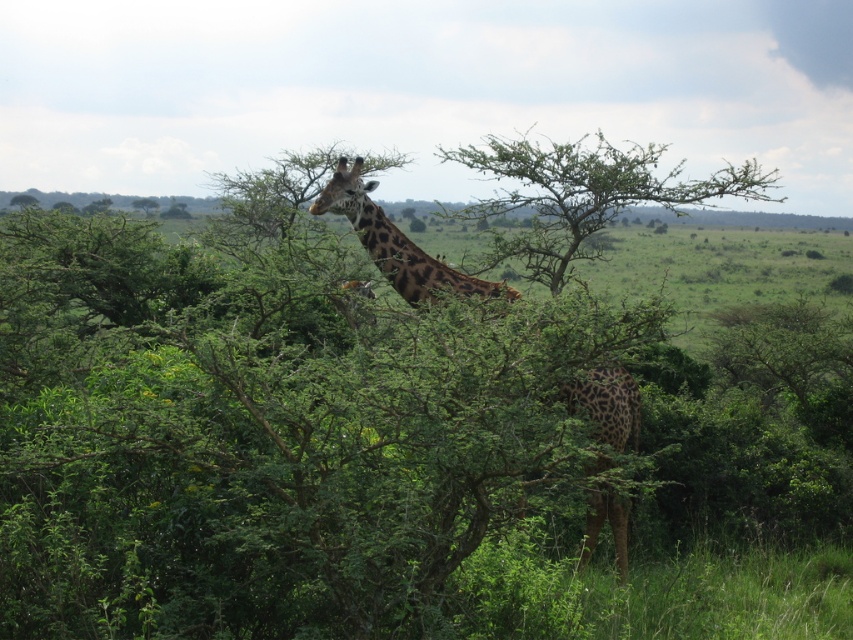
Question: Estimate the real-world distances between objects in this image. Which object is closer to the green leafy tree at center?

Choices:
 (A) spotted fur giraffe at center
 (B) green leafy bush at center

Answer: (B)

Question: Is green leafy bush at center positioned behind green leafy tree at center?

Choices:
 (A) yes
 (B) no

Answer: (B)

Question: Can you confirm if green leafy bush at center is smaller than spotted fur giraffe at center?

Choices:
 (A) no
 (B) yes

Answer: (A)

Question: Can you confirm if green leafy tree at center is positioned to the left of spotted fur giraffe at center?

Choices:
 (A) yes
 (B) no

Answer: (B)

Question: Which point is closer to the camera taking this photo?

Choices:
 (A) (402, 484)
 (B) (363, 204)
 (C) (537, 189)

Answer: (A)

Question: Considering the real-world distances, which object is closest to the green leafy bush at center?

Choices:
 (A) green leafy tree at center
 (B) spotted fur giraffe at center

Answer: (B)